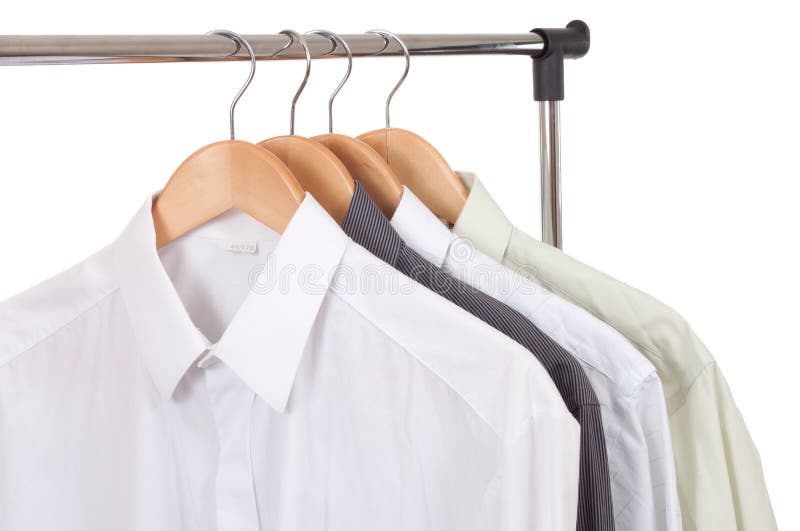
Identify the location of clothes hangers. (234, 158), (313, 157), (357, 154), (421, 156).